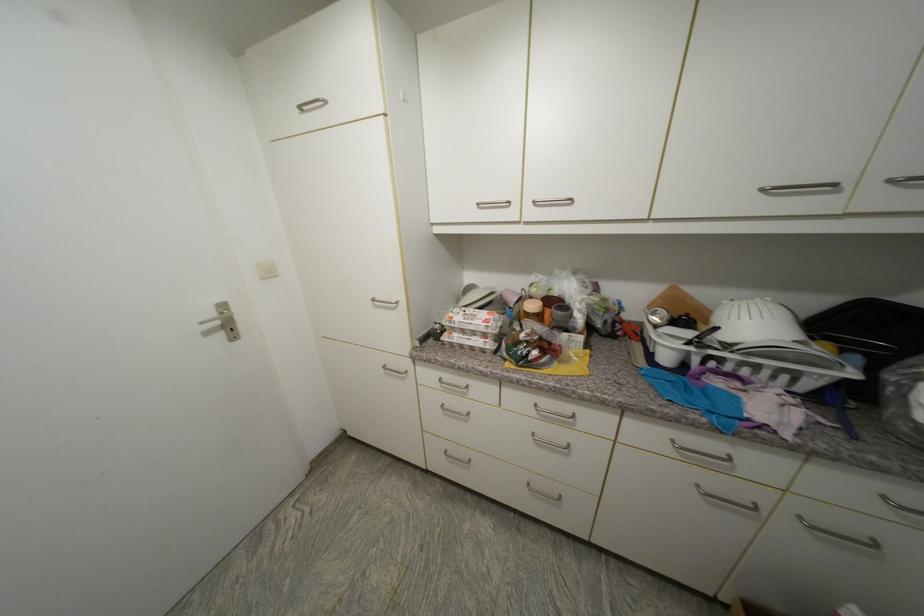
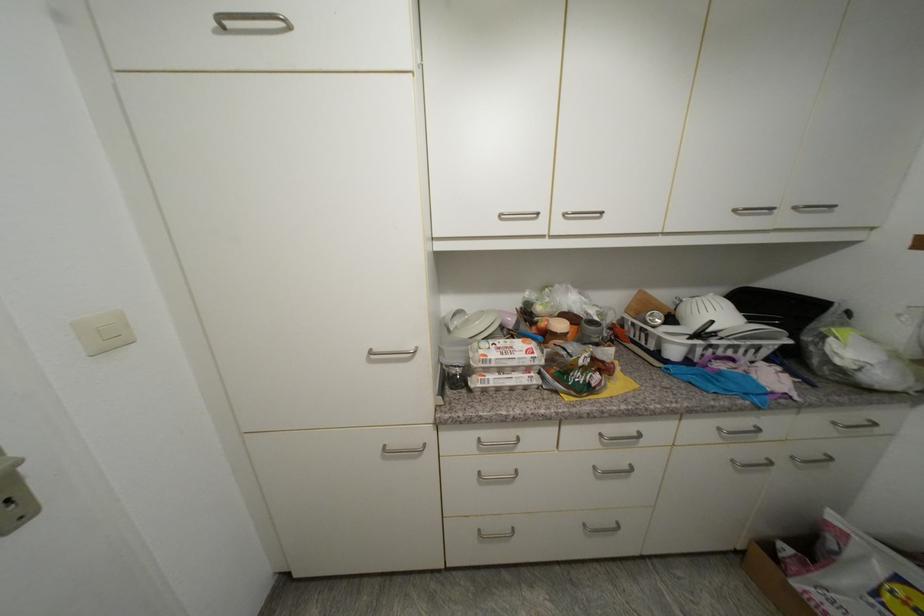
Where in the second image is the point corresponding to (x=540, y=204) from the first image?

(570, 216)